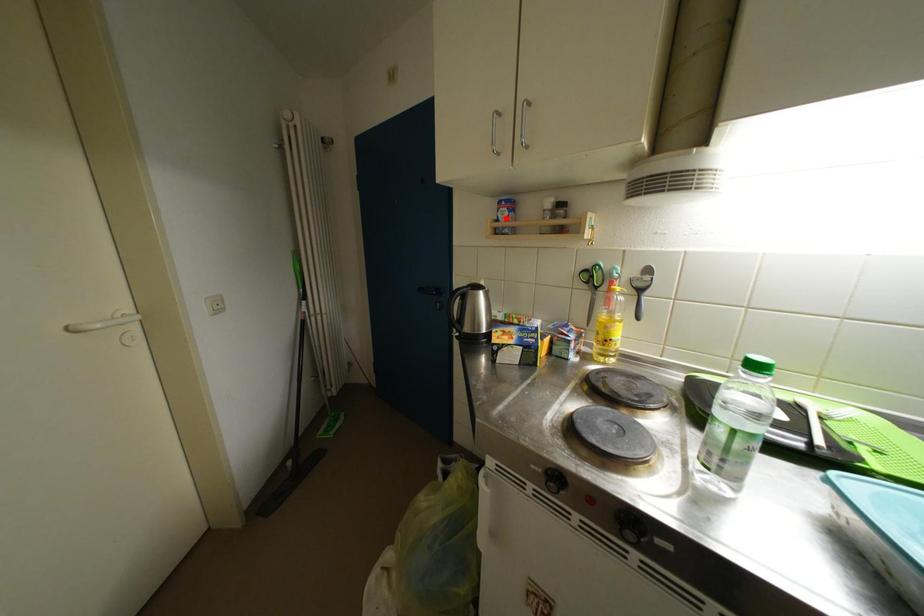
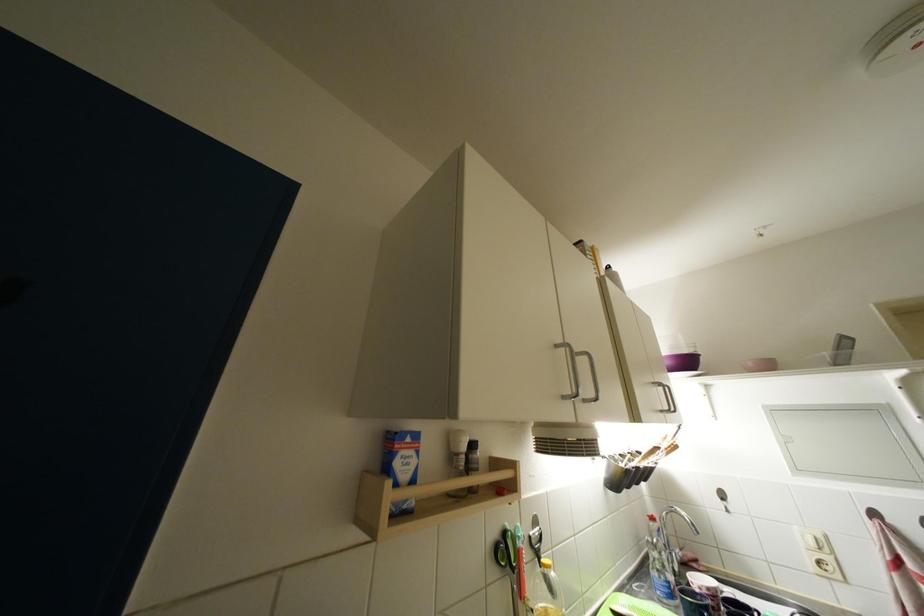
In the second image, find the point that corresponds to the highlighted location in the first image.

(404, 467)